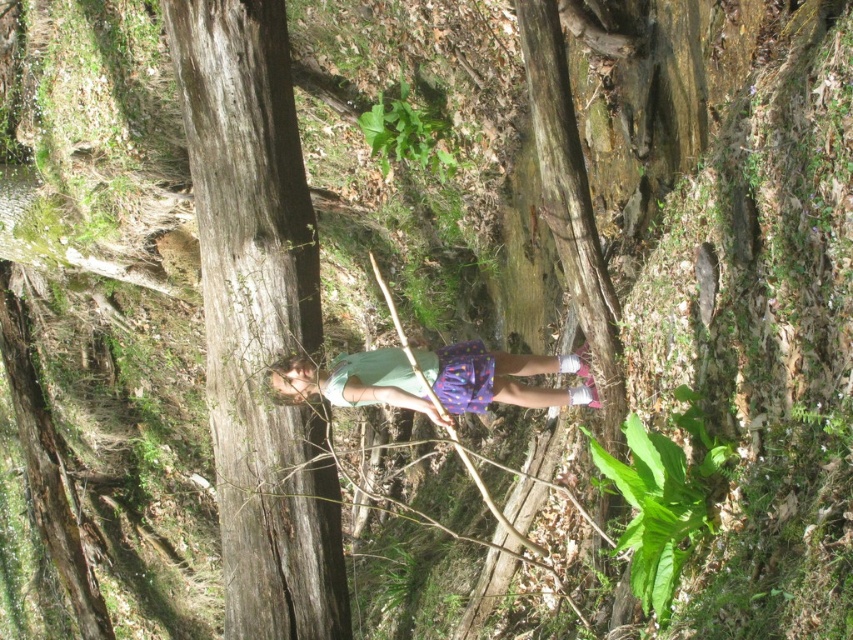
You are a hiker trying to reach your friend who is standing near the multicolored fabric shorts at center. There is a smooth brown tree trunk at left in your path. Which object will you encounter first?

You will encounter the smooth brown tree trunk at left first because it is closer to you than the multicolored fabric shorts at center.

You are standing at the center of the image and want to find the smooth brown tree trunk at left. In which direction should you look to locate it?

You should look to the left to locate the smooth brown tree trunk at left since its 2D location is at point (258,320), which places it on the left side of the image.